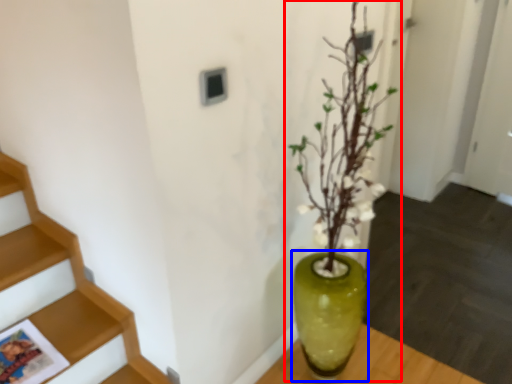
Question: Among these objects, which one is farthest to the camera, houseplant (highlighted by a red box) or vase (highlighted by a blue box)?

Choices:
 (A) houseplant
 (B) vase

Answer: (B)